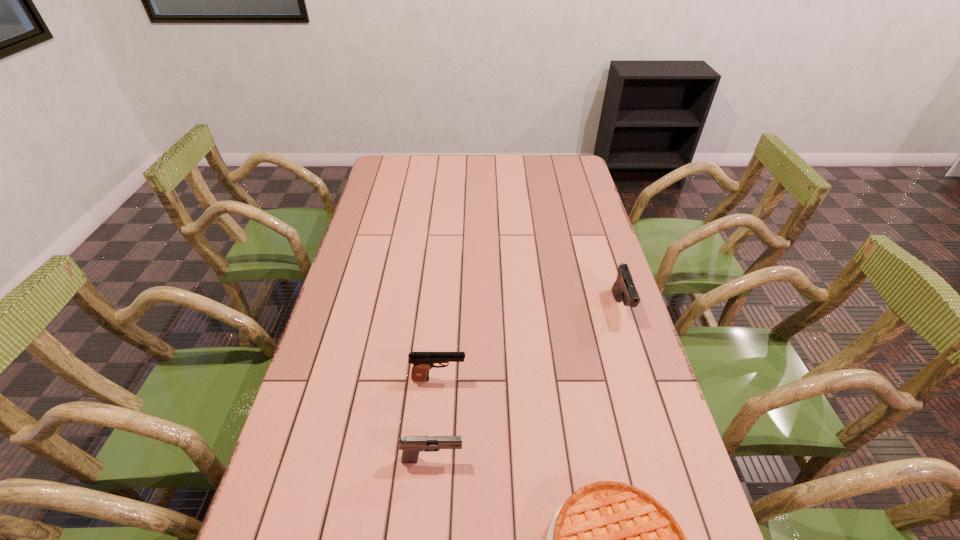
This screenshot has height=540, width=960. In the image, there is a desktop. Find the location of `vacant space at the right edge`. vacant space at the right edge is located at coordinates (576, 199).

I want to click on vacant space at the far left corner, so click(391, 166).

Where is `empty location between the second nearest pistol and the rightmost object`? This screenshot has height=540, width=960. empty location between the second nearest pistol and the rightmost object is located at coordinates click(x=530, y=343).

You are a GUI agent. You are given a task and a screenshot of the screen. Output one action in this format:
    pyautogui.click(x=<x>, y=<y>)
    Task: Click on the free spot between the second nearest pistol and the third farthest object
    The image size is (960, 540).
    Given the screenshot: What is the action you would take?
    tap(436, 419)

Where is `free space between the rightmost object and the second farthest object`? This screenshot has height=540, width=960. free space between the rightmost object and the second farthest object is located at coordinates (530, 343).

Identify the location of free area in between the third farthest object and the third nearest object. (436, 419).

Image resolution: width=960 pixels, height=540 pixels. I want to click on vacant area that lies between the third nearest object and the nearest pistol, so pos(436,419).

Select which object appears as the second closest to the third farthest object. Please provide its 2D coordinates. Your answer should be formatted as a tuple, i.e. [(x, y)], where the tuple contains the x and y coordinates of a point satisfying the conditions above.

[(422, 362)]

Locate an element on the screen. The height and width of the screenshot is (540, 960). object that is the second closest to the second object from right to left is located at coordinates [422, 362].

You are a GUI agent. You are given a task and a screenshot of the screen. Output one action in this format:
    pyautogui.click(x=<x>, y=<y>)
    Task: Click on the pistol that is the closest to the rightmost object
    
    Given the screenshot: What is the action you would take?
    pyautogui.click(x=422, y=362)